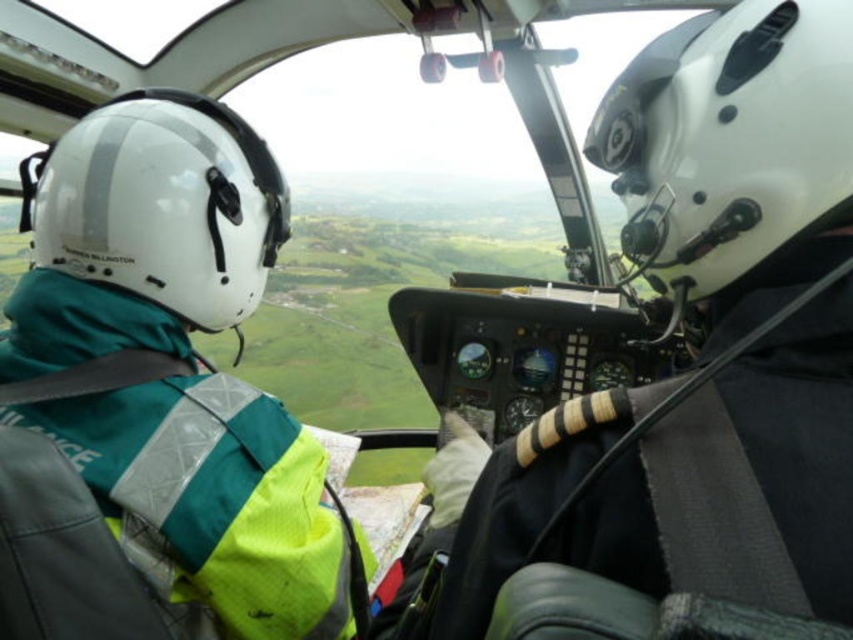
Between green fabric jacket at upper left and white matte helmet at left, which one is positioned lower?

green fabric jacket at upper left is lower down.

Where is `green fabric jacket at upper left`? This screenshot has width=853, height=640. green fabric jacket at upper left is located at coordinates (177, 358).

Identify the location of green fabric jacket at upper left. (177, 358).

Consider the image. Does green fabric jacket at upper left have a greater width compared to white matte helmet at center?

Yes.

In the scene shown: Who is more distant from viewer, (x=310, y=472) or (x=840, y=196)?

Positioned behind is point (x=310, y=472).

Locate an element on the screen. green fabric jacket at upper left is located at coordinates (177, 358).

Does white matte helmet at center have a larger size compared to white matte helmet at left?

Actually, white matte helmet at center might be smaller than white matte helmet at left.

Does white matte helmet at center come behind white matte helmet at left?

No, it is in front of white matte helmet at left.

Does point (689, 269) come farther from viewer compared to point (241, 200)?

No, it is not.

The width and height of the screenshot is (853, 640). What are the coordinates of `white matte helmet at center` in the screenshot? It's located at (730, 138).